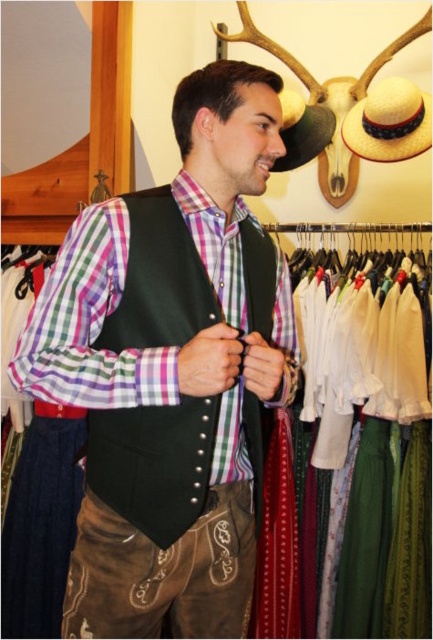
Is black leather vest at center above natural straw hat at upper right?

No, black leather vest at center is not above natural straw hat at upper right.

Where is `black leather vest at center`? black leather vest at center is located at coordinates (154, 464).

Is point (228, 413) less distant than point (171, 410)?

No, (228, 413) is further to viewer.

Does matte black vest at center appear on the right side of black leather vest at center?

In fact, matte black vest at center is to the left of black leather vest at center.

Is point (238, 294) farther from camera compared to point (138, 428)?

Yes, it is.

Where is `matte black vest at center`? matte black vest at center is located at coordinates (171, 371).

Which is above, matte black vest at center or natural straw hat at upper right?

natural straw hat at upper right is above.

Which is behind, point (109, 269) or point (387, 90)?

Point (387, 90)

Which is in front, point (242, 168) or point (393, 131)?

Point (242, 168)

What are the coordinates of `matte black vest at center` in the screenshot? It's located at (171, 371).